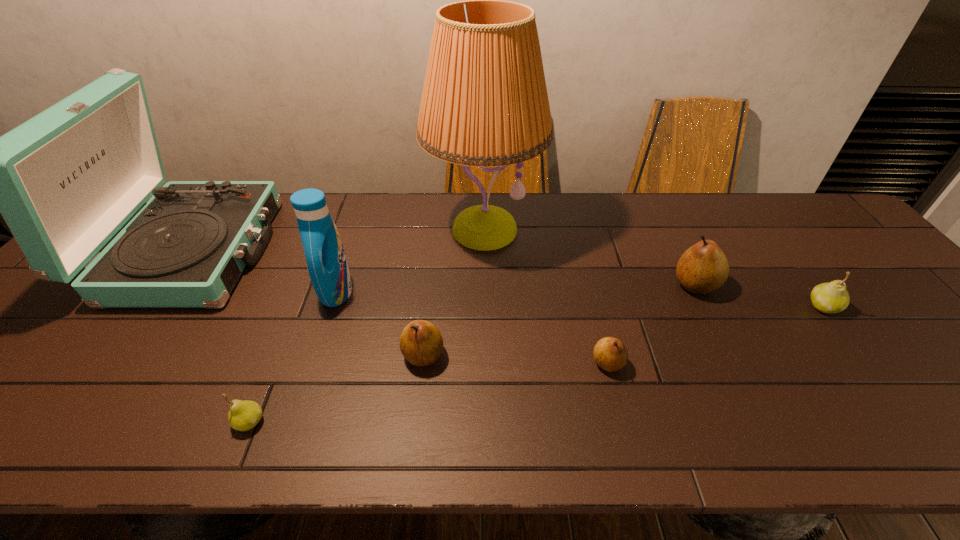
Image resolution: width=960 pixels, height=540 pixels. Identify the location of vacant space in between the third tallest object and the smallest brown pear. (472, 327).

Where is `vacant area that lies between the leftmost brown pear and the beige lamp`? This screenshot has width=960, height=540. vacant area that lies between the leftmost brown pear and the beige lamp is located at coordinates (453, 292).

Identify the location of vacant region between the seventh shortest object and the seventh object from left to right. This screenshot has width=960, height=540. (444, 268).

Where is `object that stands as the fourth closest to the tallest object`? The width and height of the screenshot is (960, 540). object that stands as the fourth closest to the tallest object is located at coordinates (703, 268).

Point out which object is positioned as the nearest to the detergent. Please provide its 2D coordinates. Your answer should be formatted as a tuple, i.e. [(x, y)], where the tuple contains the x and y coordinates of a point satisfying the conditions above.

[(484, 103)]

Find the location of a particular element. This screenshot has width=960, height=540. the closest pear to the seventh object from right to left is located at coordinates (421, 343).

Where is `the fourth closest pear to the third tallest object`? The width and height of the screenshot is (960, 540). the fourth closest pear to the third tallest object is located at coordinates (703, 268).

Locate an element on the screen. brown pear that is the second closest to the farthest brown pear is located at coordinates (421, 343).

The height and width of the screenshot is (540, 960). In order to click on the closest brown pear relative to the tallest object in this screenshot , I will do pyautogui.click(x=421, y=343).

This screenshot has height=540, width=960. Identify the location of vacant area that satisfies the following two spatial constraints: 1. on the back side of the tallest pear; 2. on the face side of the second tallest object. (679, 251).